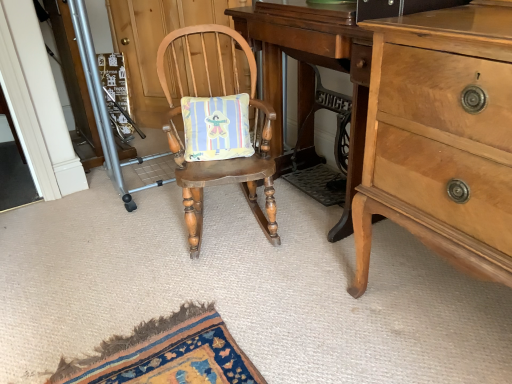
Where is `vacant space situated on the left part of light brown wood dresser at right`? vacant space situated on the left part of light brown wood dresser at right is located at coordinates point(302,309).